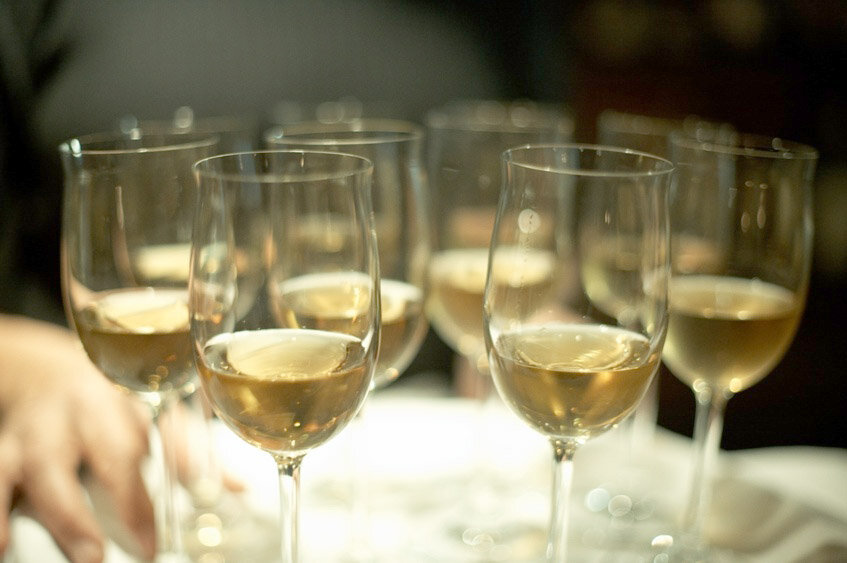
You are a GUI agent. You are given a task and a screenshot of the screen. Output one action in this format:
    pyautogui.click(x=<x>, y=<y>)
    Task: Click on the champagne glasses
    Image resolution: width=847 pixels, height=563 pixels.
    Given the screenshot: What is the action you would take?
    pyautogui.click(x=152, y=159), pyautogui.click(x=373, y=146), pyautogui.click(x=308, y=193), pyautogui.click(x=469, y=142), pyautogui.click(x=573, y=225), pyautogui.click(x=624, y=129), pyautogui.click(x=715, y=193)